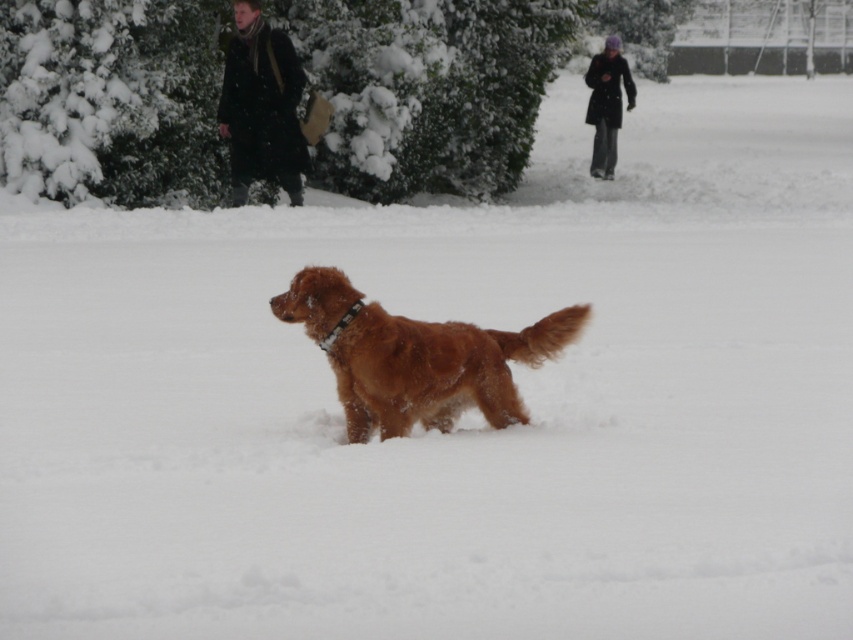
Question: Among these objects, which one is nearest to the camera?

Choices:
 (A) dark brown leather coat at upper left
 (B) brown furry dog at center

Answer: (B)

Question: Is dark brown leather coat at upper left to the right of dark gray wool coat at upper right from the viewer's perspective?

Choices:
 (A) no
 (B) yes

Answer: (A)

Question: Is brown furry dog at center further to the viewer compared to dark gray wool coat at upper right?

Choices:
 (A) yes
 (B) no

Answer: (B)

Question: Which object appears farthest from the camera in this image?

Choices:
 (A) brown furry dog at center
 (B) dark brown leather coat at upper left

Answer: (B)

Question: Which point appears farthest from the camera in this image?

Choices:
 (A) [x=264, y=116]
 (B) [x=309, y=312]

Answer: (A)

Question: Can you confirm if brown furry dog at center is bigger than dark gray wool coat at upper right?

Choices:
 (A) no
 (B) yes

Answer: (B)